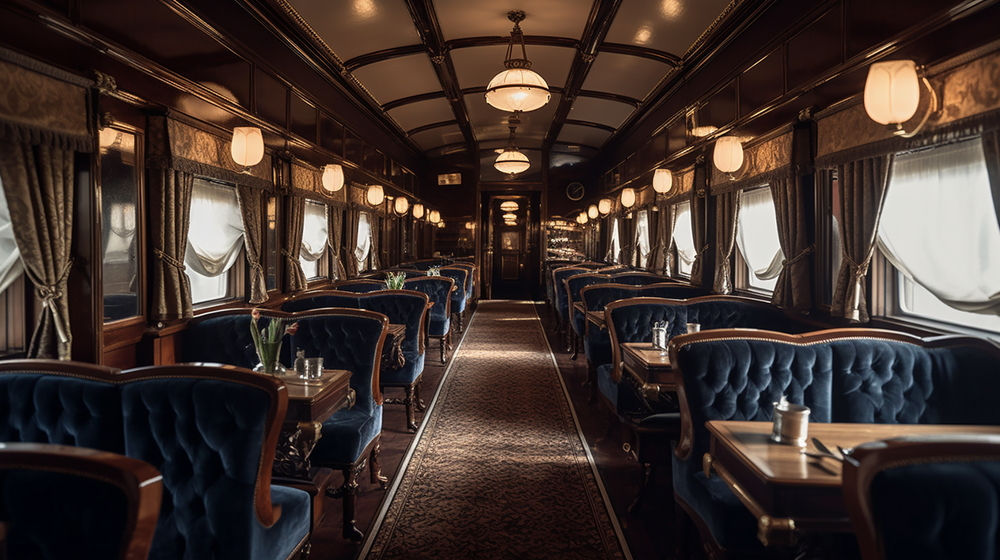
Image resolution: width=1000 pixels, height=560 pixels. Identify the location of hallway. (507, 269).